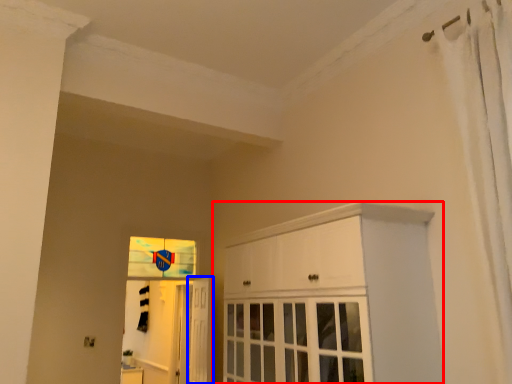
Question: Which object appears closest to the camera in this image, cabinetry (highlighted by a red box) or door (highlighted by a blue box)?

Choices:
 (A) cabinetry
 (B) door

Answer: (A)